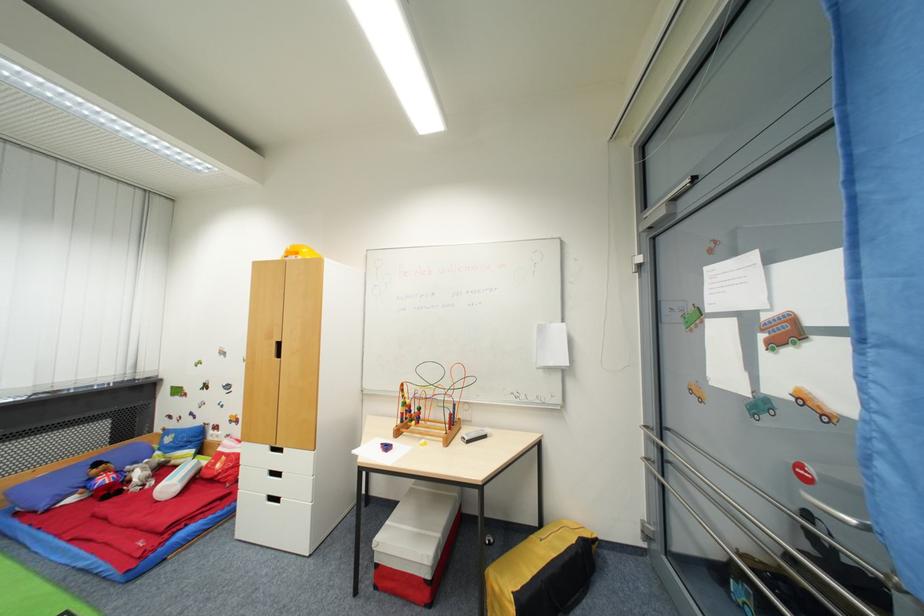
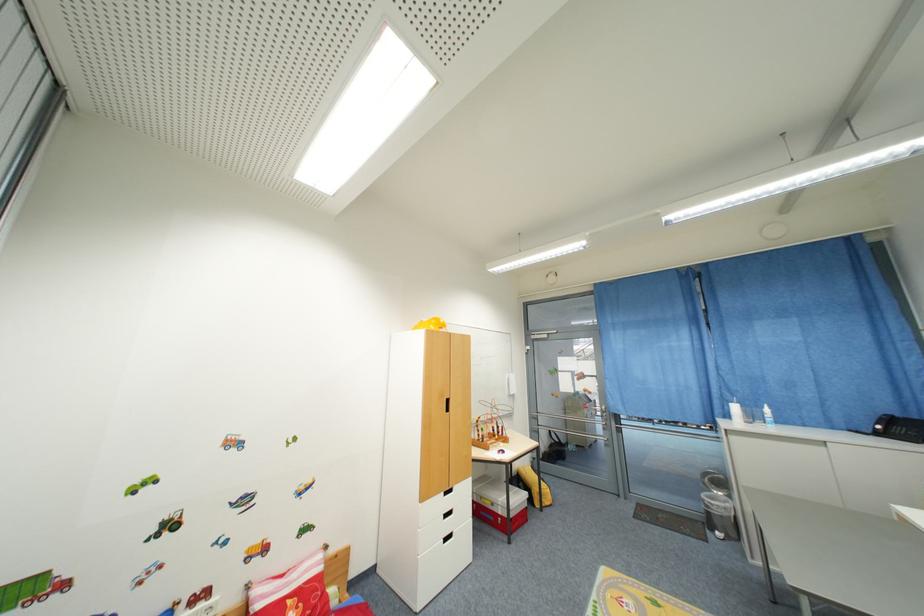
Where in the second image is the point corresponding to [417,422] from the first image?

(500, 438)